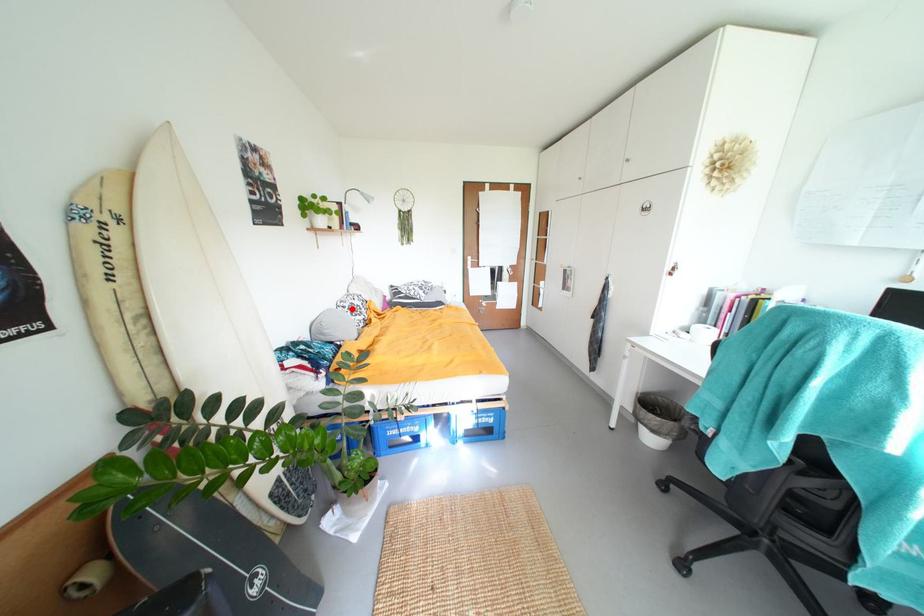
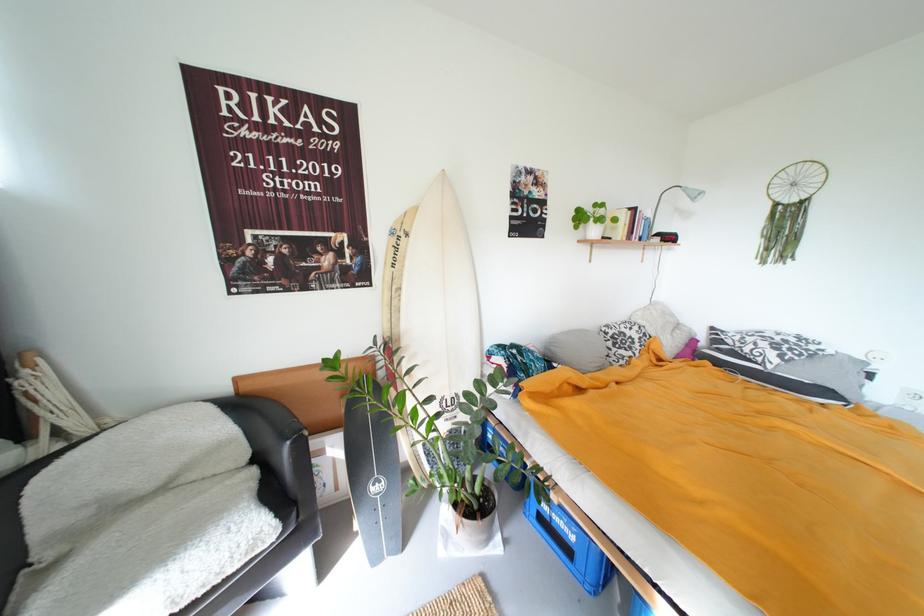
Question: I am providing you with two images of the same scene from different viewpoints. In image1, a red point is highlighted. Considering the same 3D point in image2, which of the following is correct?

Choices:
 (A) It is closer
 (B) It is farther

Answer: (B)